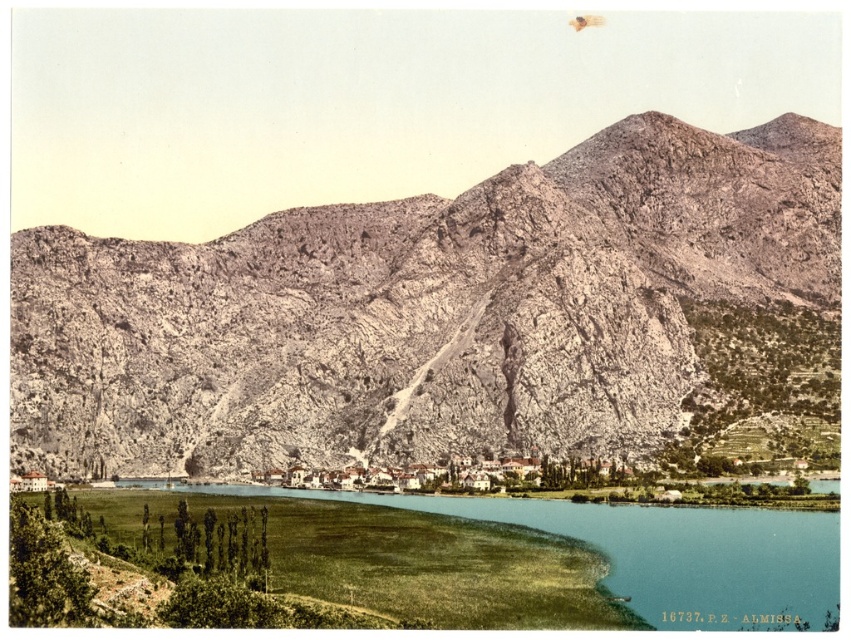
Question: Which object is farther from the camera taking this photo?

Choices:
 (A) green grassy water at lower center
 (B) rugged stone mountain range at center

Answer: (B)

Question: Does rugged stone mountain range at center have a larger size compared to green grassy water at lower center?

Choices:
 (A) no
 (B) yes

Answer: (B)

Question: Is rugged stone mountain range at center positioned at the back of green grassy water at lower center?

Choices:
 (A) yes
 (B) no

Answer: (A)

Question: Which object appears farthest from the camera in this image?

Choices:
 (A) rugged stone mountain range at center
 (B) green grassy water at lower center

Answer: (A)

Question: Which point is farther to the camera?

Choices:
 (A) green grassy water at lower center
 (B) rugged stone mountain range at center

Answer: (B)

Question: Does rugged stone mountain range at center lie in front of green grassy water at lower center?

Choices:
 (A) yes
 (B) no

Answer: (B)